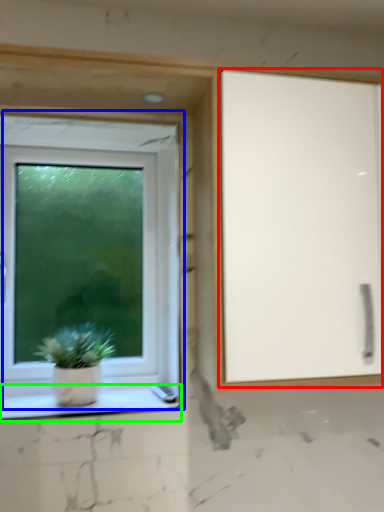
Question: Which object is the closest to the screen door (highlighted by a red box)? Choose among these: window (highlighted by a blue box) or window sill (highlighted by a green box).

Choices:
 (A) window
 (B) window sill

Answer: (A)